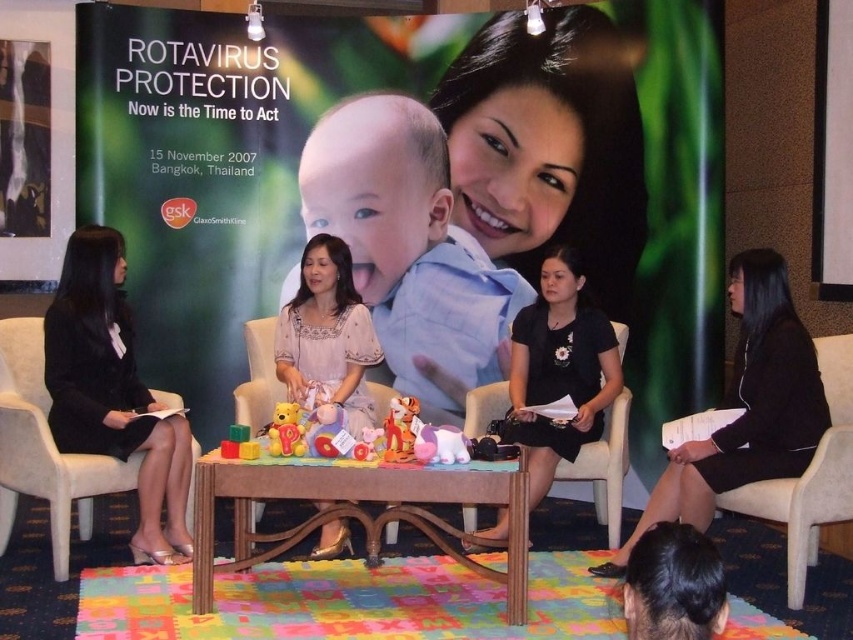
You are organizing a childrens event and need to place a small gift box between the soft plush toy at center and the soft plush bear at center. Which object should the gift box be placed closer to if it needs to be near the bottom?

The gift box should be placed closer to the soft plush bear at center because the soft plush toy at center is positioned over it, meaning the bear is lower down.

You are organizing a childrens event and need to place a soft plush toy at center and a soft plush bear at center on a table. The table has a maximum length of 10 centimeters between any two items. Can both items be placed on the table without exceeding the tables length limit?

The distance between the soft plush toy at center and the soft plush bear at center is 9.26 centimeters, which is under the 10 centimeter limit. Therefore, both items can be placed on the table without exceeding the tables length limit.